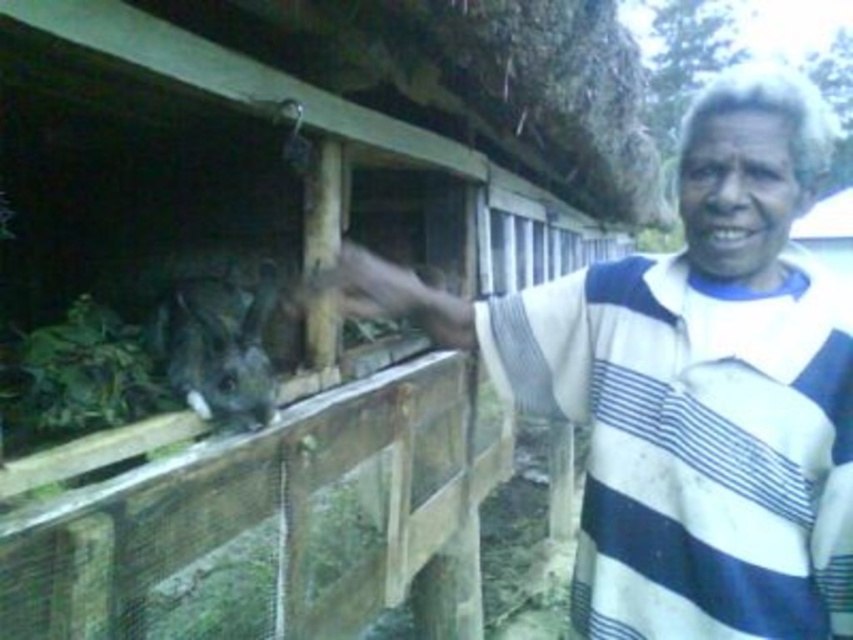
Based on the photo, who is shorter, white striped shirt at center or furry gray rabbit at center?

furry gray rabbit at center is shorter.

Does white striped shirt at center appear under furry gray rabbit at center?

Indeed, white striped shirt at center is positioned under furry gray rabbit at center.

Which is behind, point (839, 332) or point (175, 378)?

The point (175, 378) is behind.

This screenshot has width=853, height=640. What are the coordinates of `white striped shirt at center` in the screenshot? It's located at (689, 387).